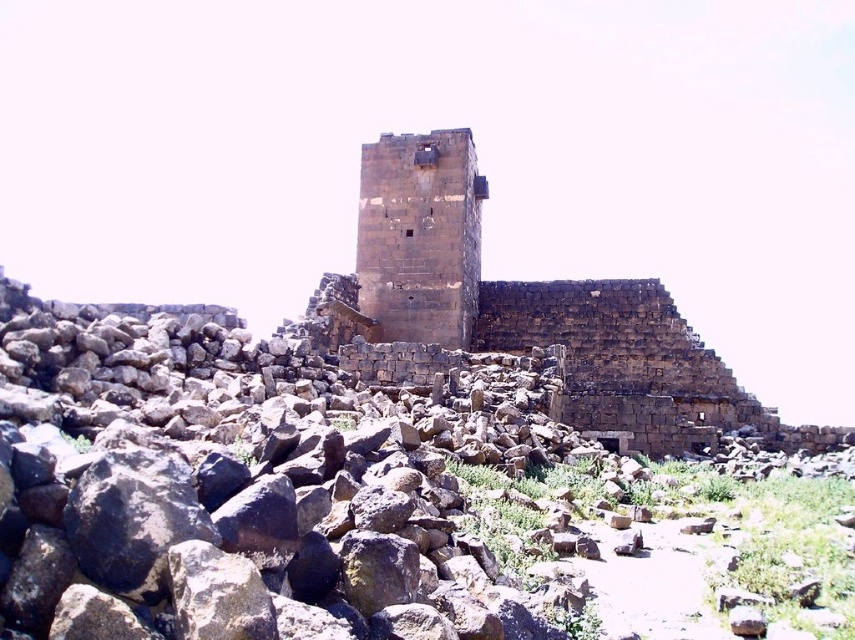
Looking at this image, can you confirm if dark brown stone tower at center is positioned above brown stone tower at center?

Actually, dark brown stone tower at center is below brown stone tower at center.

Between dark brown stone tower at center and brown stone tower at center, which one is positioned higher?

brown stone tower at center is above.

Is point (570, 280) positioned after point (385, 244)?

Yes, it is behind point (385, 244).

At what (x,y) coordinates should I click in order to perform the action: click on dark brown stone tower at center. Please return your answer as a coordinate pair (x, y). The image size is (855, 640). Looking at the image, I should click on point(513,310).